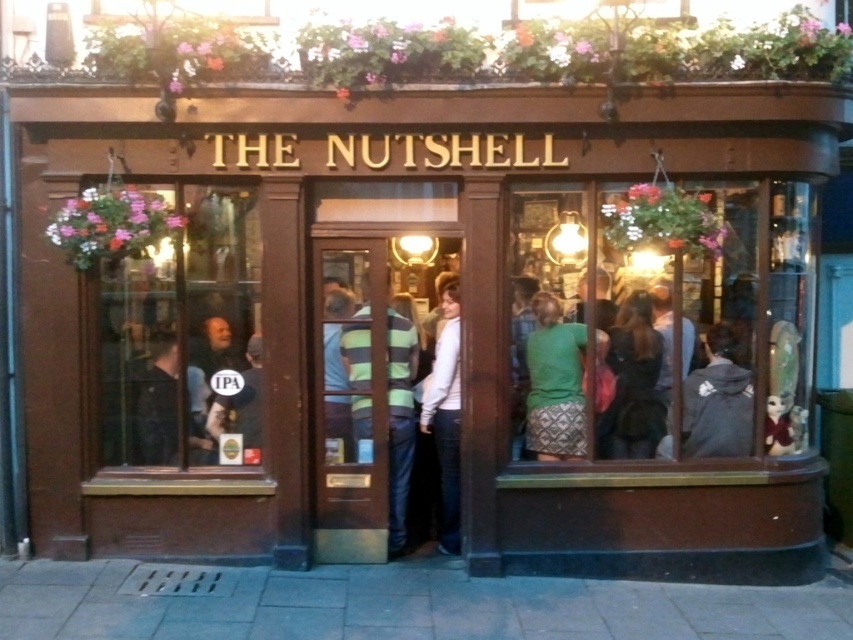
Question: Based on their relative distances, which object is nearer to the dark fabric shirt at left?

Choices:
 (A) green textured sweater at center
 (B) dark gray hoodie at right
 (C) dark brown leather jacket at lower right

Answer: (A)

Question: Which object is positioned farthest from the matte black signboard at lower left?

Choices:
 (A) dark gray hoodie at right
 (B) dark brown leather jacket at lower right

Answer: (A)

Question: Is green textured sweater at center behind striped jersey at center?

Choices:
 (A) no
 (B) yes

Answer: (B)

Question: Is dark gray hoodie at right bigger than matte black signboard at lower left?

Choices:
 (A) yes
 (B) no

Answer: (A)

Question: Is green textured sweater at center above matte black signboard at lower left?

Choices:
 (A) no
 (B) yes

Answer: (B)

Question: Which object is closer to the camera taking this photo?

Choices:
 (A) dark fabric shirt at left
 (B) wooden door at center

Answer: (B)